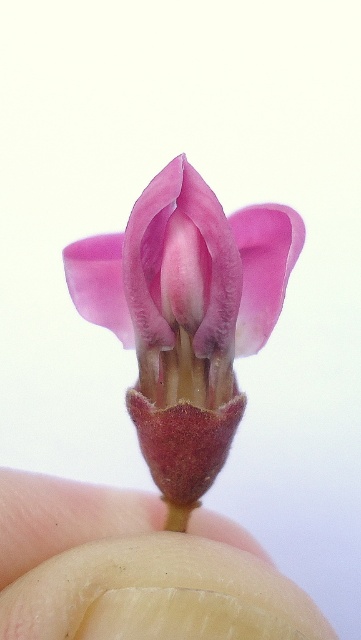
You are holding a flower bud between your fingers and want to place a sticker on the part of the bud that is closer to you. According to the image, which point should you choose between point (141, 225) and point (19, 609)?

Point (19, 609) is closer to you, so you should place the sticker there.

You are holding a flower between your fingers and looking at it closely. The scene shows a pink matte flower at center and a smooth beige finger at center. Which object is positioned to the right side?

The pink matte flower at center is to the right of the smooth beige finger at center.